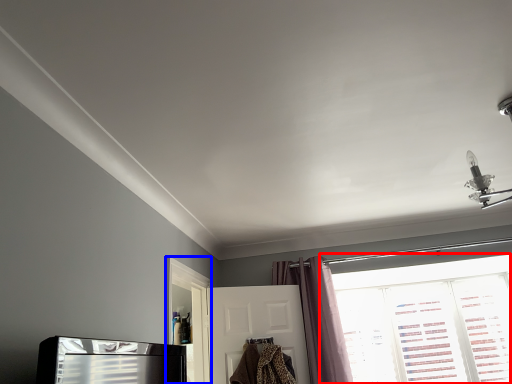
Question: Which object appears closest to the camera in this image, window (highlighted by a red box) or screen door (highlighted by a blue box)?

Choices:
 (A) window
 (B) screen door

Answer: (B)